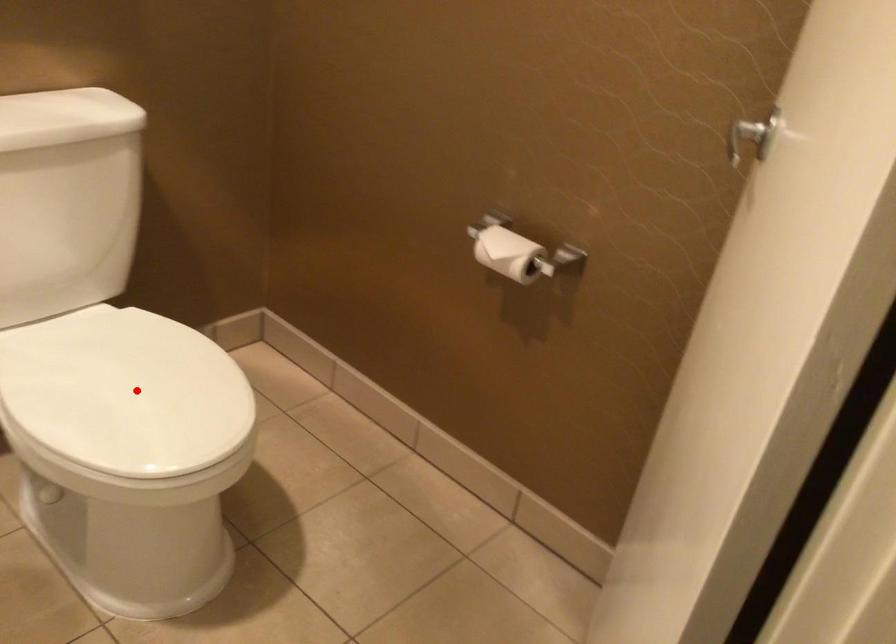
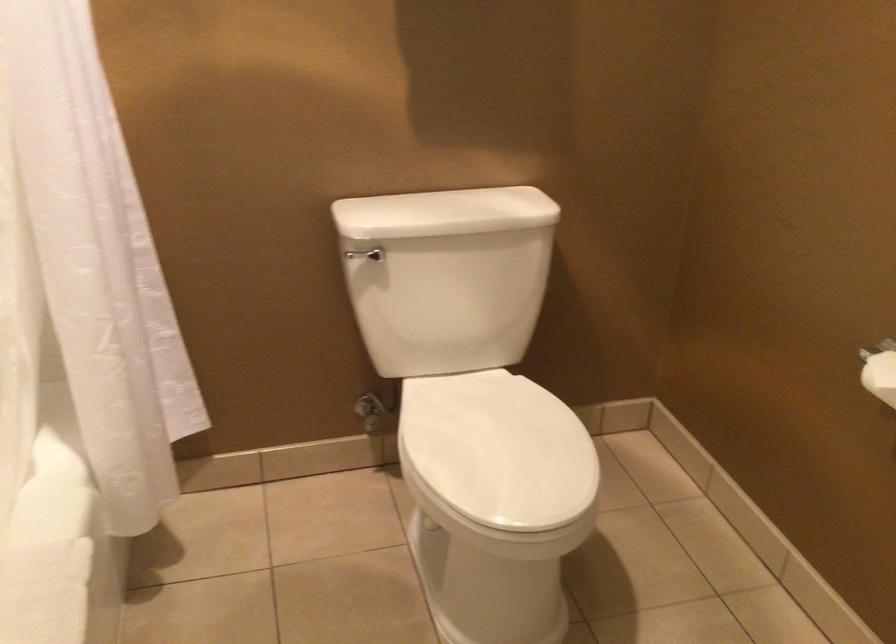
Where in the second image is the point corresponding to the highlighted location from the first image?

(498, 450)